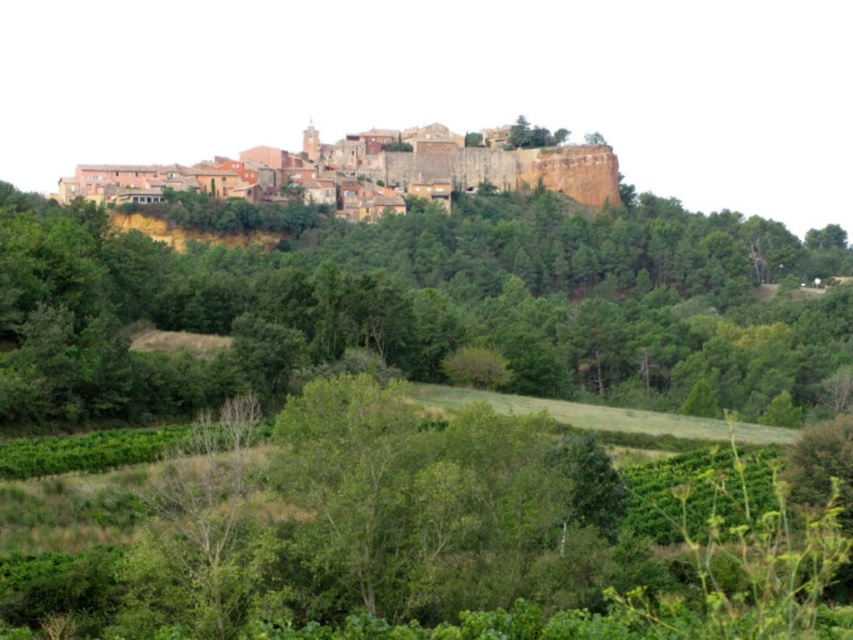
Question: Can you confirm if green leafy tree at upper center is positioned to the left of terracotta stone town at upper center?

Choices:
 (A) no
 (B) yes

Answer: (A)

Question: Is green leafy tree at upper center above terracotta stone town at upper center?

Choices:
 (A) yes
 (B) no

Answer: (B)

Question: Which of the following is the farthest from the observer?

Choices:
 (A) terracotta stone town at upper center
 (B) green leafy tree at upper center

Answer: (A)

Question: Does green leafy tree at upper center appear on the left side of terracotta stone town at upper center?

Choices:
 (A) yes
 (B) no

Answer: (B)